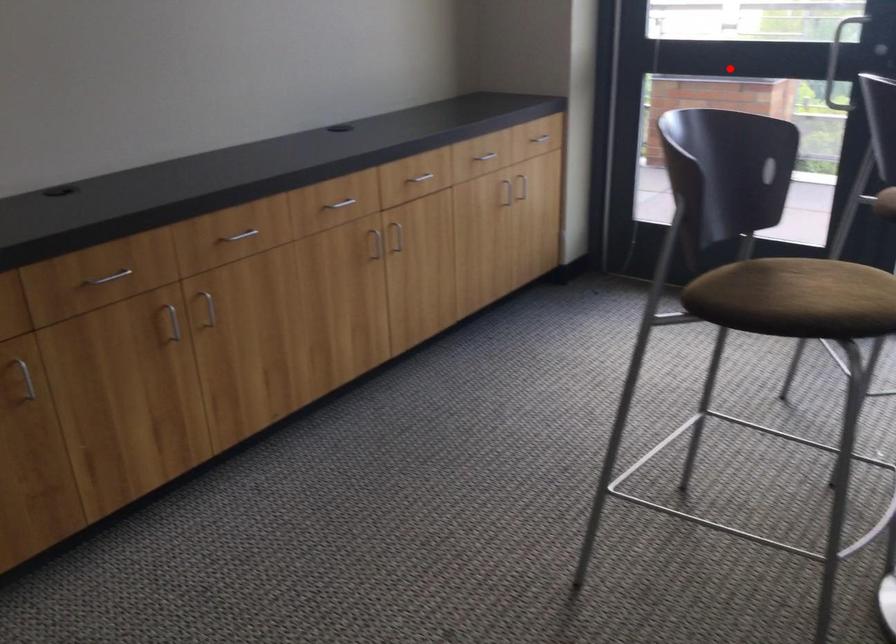
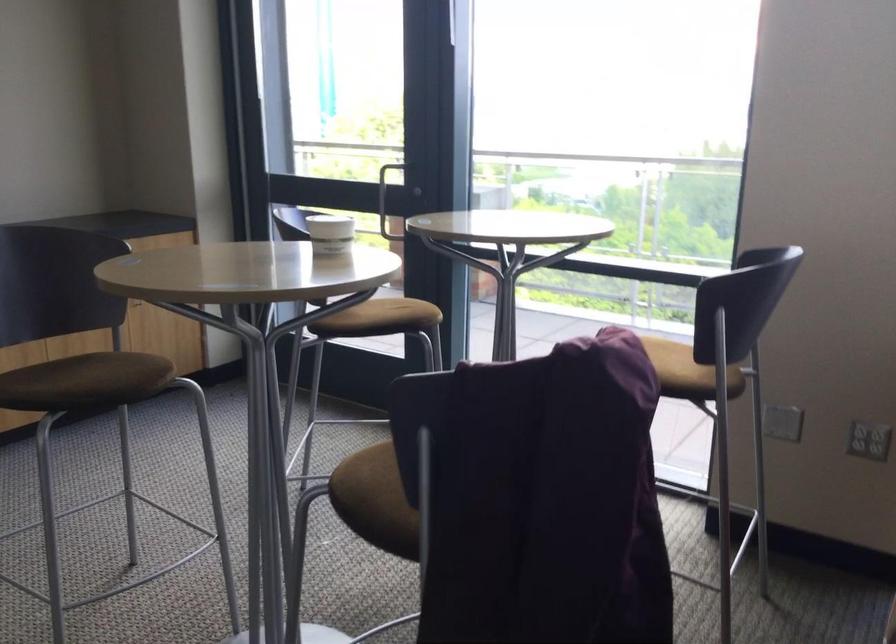
Question: I am providing you with two images of the same scene from different viewpoints. A red point is shown in image1. For the corresponding object point in image2, is it positioned nearer or farther from the camera?

Choices:
 (A) Nearer
 (B) Farther

Answer: (B)